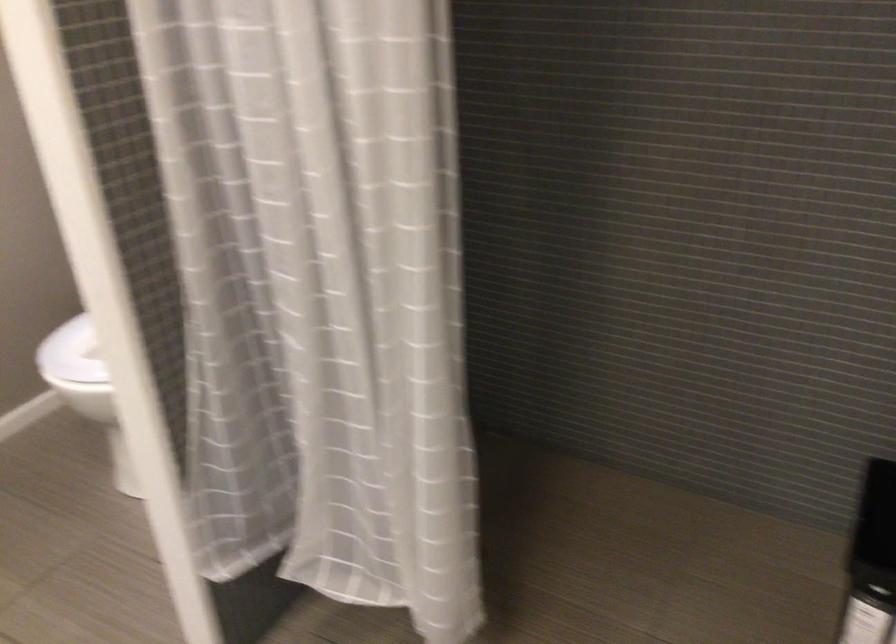
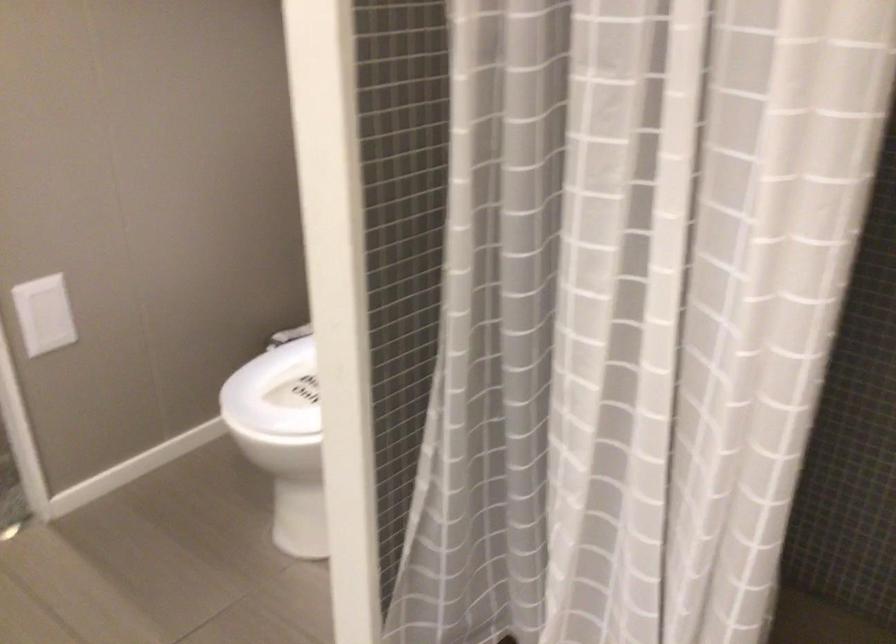
Which direction would the cameraman need to move to produce the second image?

The movement direction of the cameraman is left, forward.